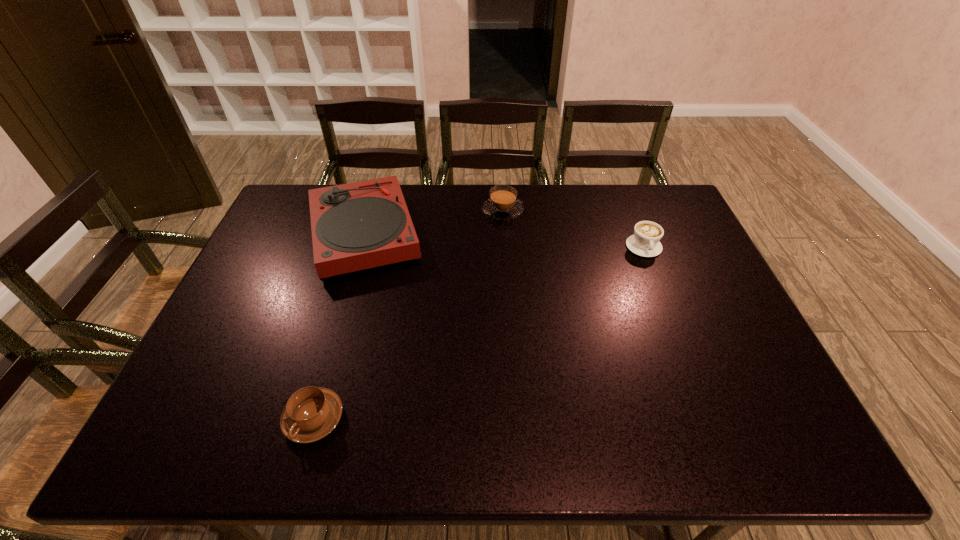
Locate which object is the closest to the second nearest cappuccino. Please provide its 2D coordinates. Your answer should be formatted as a tuple, i.e. [(x, y)], where the tuple contains the x and y coordinates of a point satisfying the conditions above.

[(503, 204)]

I want to click on cappuccino that is the second closest one to the nearest cappuccino, so click(645, 242).

Find the location of a particular element. The image size is (960, 540). cappuccino that stands as the closest to the nearest cappuccino is located at coordinates 503,204.